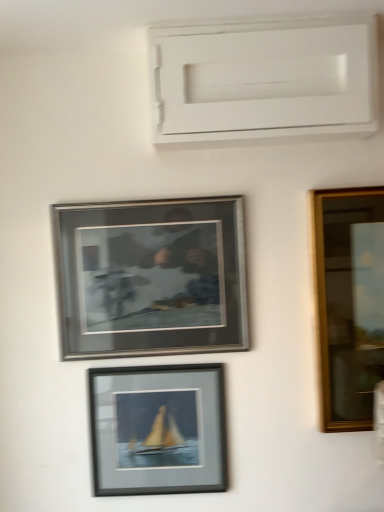
Question: Is matte black frame at center, the first picture frame when ordered from bottom to top, behind silver metallic frame at center, the 2th picture frame when ordered from bottom to top?

Choices:
 (A) no
 (B) yes

Answer: (B)

Question: Can you confirm if matte black frame at center, marked as the second picture frame in a top-to-bottom arrangement, is shorter than silver metallic frame at center, the 2th picture frame when ordered from bottom to top?

Choices:
 (A) no
 (B) yes

Answer: (B)

Question: Is matte black frame at center, marked as the second picture frame in a top-to-bottom arrangement, closer to the viewer compared to silver metallic frame at center, the 2th picture frame when ordered from bottom to top?

Choices:
 (A) no
 (B) yes

Answer: (A)

Question: Can you confirm if matte black frame at center, the first picture frame when ordered from bottom to top, is bigger than silver metallic frame at center, which is the first picture frame from top to bottom?

Choices:
 (A) yes
 (B) no

Answer: (B)

Question: Is matte black frame at center, marked as the second picture frame in a top-to-bottom arrangement, thinner than silver metallic frame at center, the 2th picture frame when ordered from bottom to top?

Choices:
 (A) yes
 (B) no

Answer: (B)

Question: From the image's perspective, is white matte window frame at upper center positioned above or below matte black frame at center, marked as the second picture frame in a top-to-bottom arrangement?

Choices:
 (A) below
 (B) above

Answer: (B)

Question: In terms of width, does white matte window frame at upper center look wider or thinner when compared to matte black frame at center, marked as the second picture frame in a top-to-bottom arrangement?

Choices:
 (A) wide
 (B) thin

Answer: (A)

Question: Is white matte window frame at upper center inside or outside of matte black frame at center, the first picture frame when ordered from bottom to top?

Choices:
 (A) inside
 (B) outside

Answer: (B)

Question: From a real-world perspective, is white matte window frame at upper center above or below matte black frame at center, the first picture frame when ordered from bottom to top?

Choices:
 (A) below
 (B) above

Answer: (B)

Question: Considering the positions of point (69, 225) and point (177, 378), is point (69, 225) closer or farther from the camera than point (177, 378)?

Choices:
 (A) closer
 (B) farther

Answer: (A)

Question: Is silver metallic frame at center, which is the first picture frame from top to bottom, taller or shorter than matte black frame at center, marked as the second picture frame in a top-to-bottom arrangement?

Choices:
 (A) tall
 (B) short

Answer: (A)

Question: In terms of size, does silver metallic frame at center, the 2th picture frame when ordered from bottom to top, appear bigger or smaller than matte black frame at center, marked as the second picture frame in a top-to-bottom arrangement?

Choices:
 (A) big
 (B) small

Answer: (A)

Question: Which is correct: silver metallic frame at center, the 2th picture frame when ordered from bottom to top, is inside matte black frame at center, marked as the second picture frame in a top-to-bottom arrangement, or outside of it?

Choices:
 (A) outside
 (B) inside

Answer: (A)

Question: In terms of width, does white matte window frame at upper center look wider or thinner when compared to silver metallic frame at center, which is the first picture frame from top to bottom?

Choices:
 (A) wide
 (B) thin

Answer: (A)

Question: Is point (218, 98) positioned closer to the camera than point (94, 340)?

Choices:
 (A) farther
 (B) closer

Answer: (B)